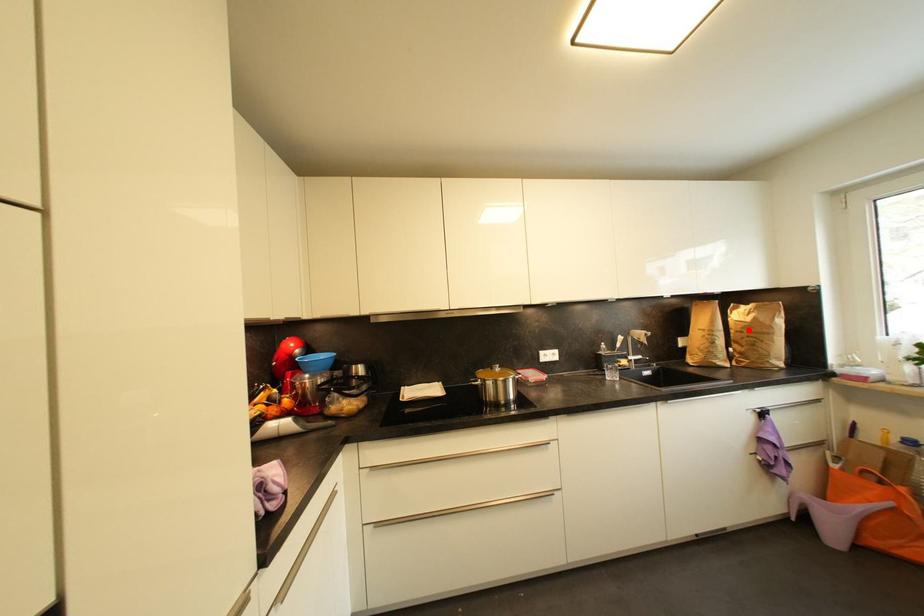
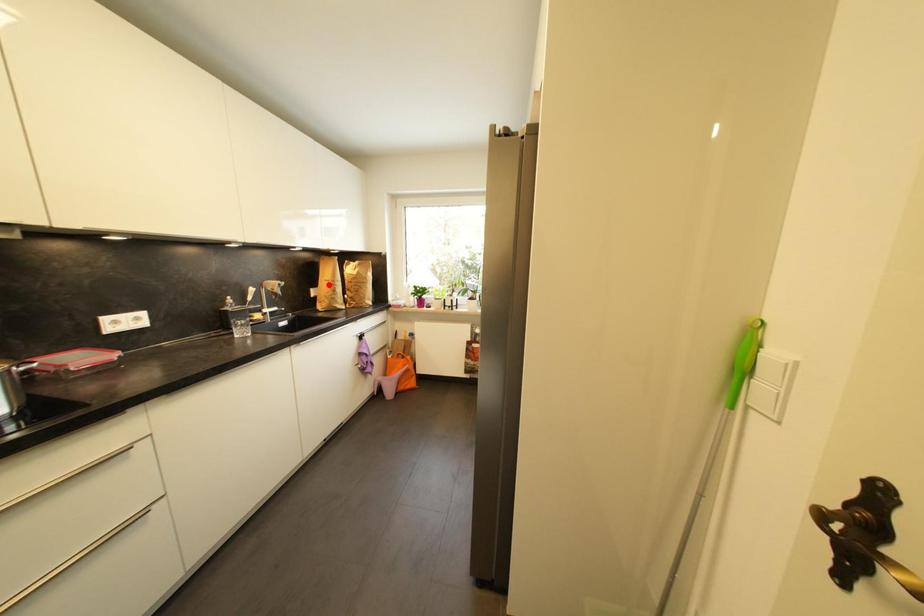
I am providing you with two images of the same scene from different viewpoints. A red point is marked on the first image and another point is marked on the second image. Are the points marked in image1 and image2 representing the same 3D position?

No